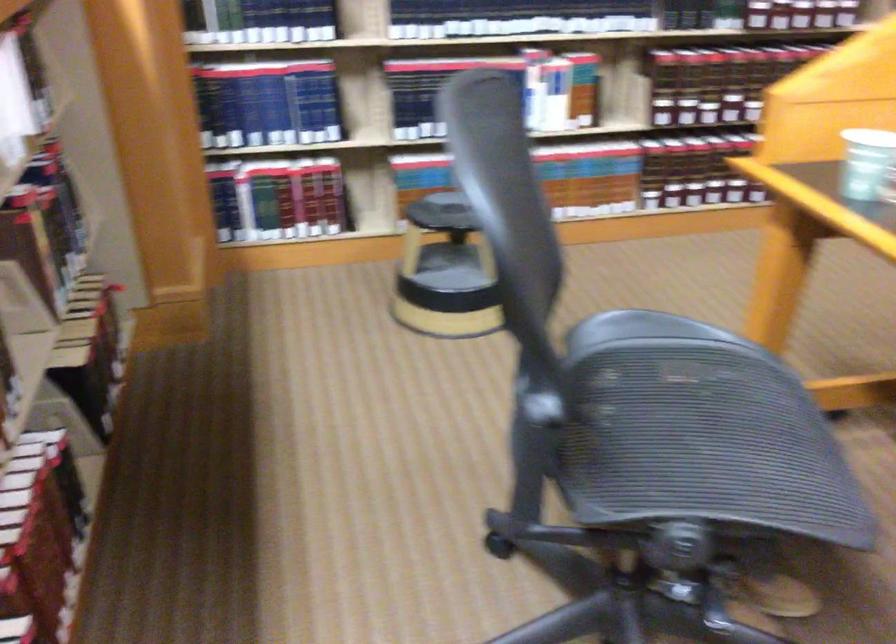
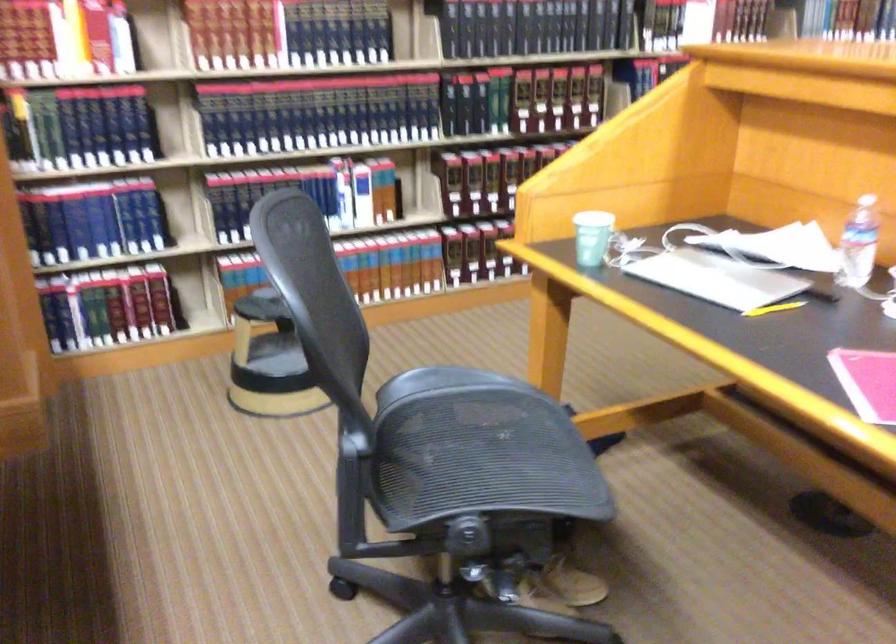
Question: The images are taken continuously from a first-person perspective. In which direction are you moving?

Choices:
 (A) Left
 (B) Right
 (C) Forward
 (D) Backward

Answer: (D)